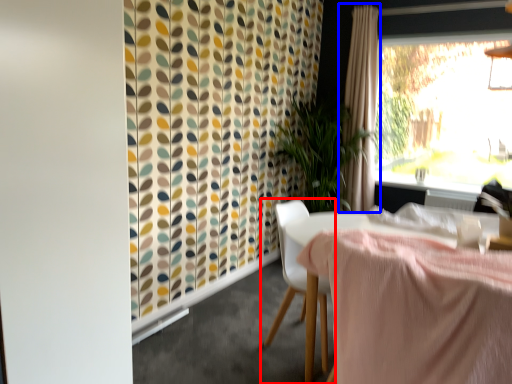
Question: Which point is closer to the camera, chair (highlighted by a red box) or curtain (highlighted by a blue box)?

Choices:
 (A) chair
 (B) curtain

Answer: (A)